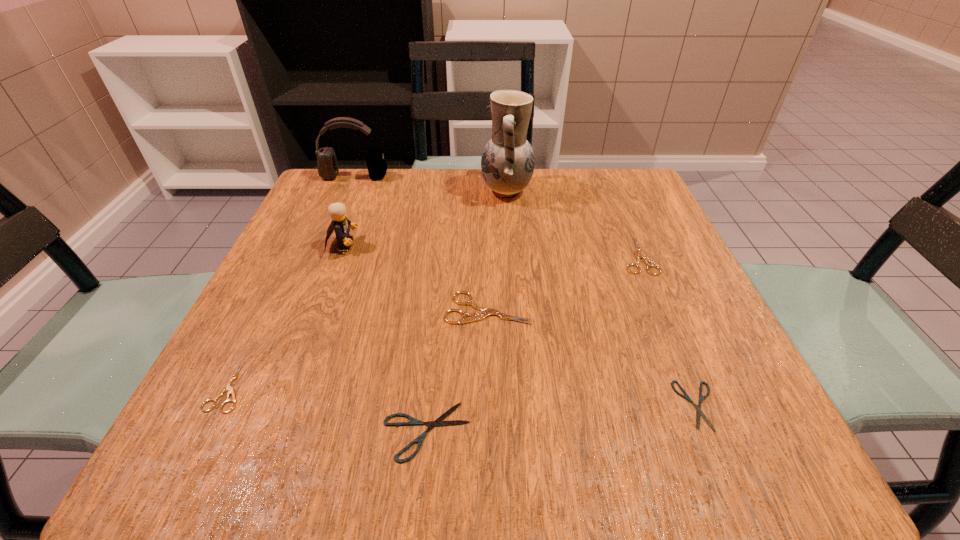
The image size is (960, 540). What are the coordinates of `object located in the near right corner section of the desktop` in the screenshot? It's located at (698, 407).

In order to click on vacant region at the far edge of the desktop in this screenshot , I will do (424, 191).

Locate an element on the screen. Image resolution: width=960 pixels, height=540 pixels. vacant space at the near edge of the desktop is located at coordinates (513, 457).

Find the location of a particular element. This screenshot has height=540, width=960. vacant area at the left edge of the desktop is located at coordinates (316, 381).

In the image, there is a desktop. Find the location of `blank space at the right edge`. blank space at the right edge is located at coordinates (660, 309).

Locate an element on the screen. vacant point at the far right corner is located at coordinates (605, 202).

Locate an element on the screen. The width and height of the screenshot is (960, 540). vacant area between the headset and the second beige shears from left to right is located at coordinates (421, 242).

Locate an element on the screen. Image resolution: width=960 pixels, height=540 pixels. free spot between the bigger black shears and the Lego is located at coordinates (385, 338).

This screenshot has width=960, height=540. In order to click on free space between the leftmost shears and the smaller black shears in this screenshot , I will do `click(464, 396)`.

This screenshot has height=540, width=960. I want to click on vacant space in between the farthest shears and the black headset, so click(496, 216).